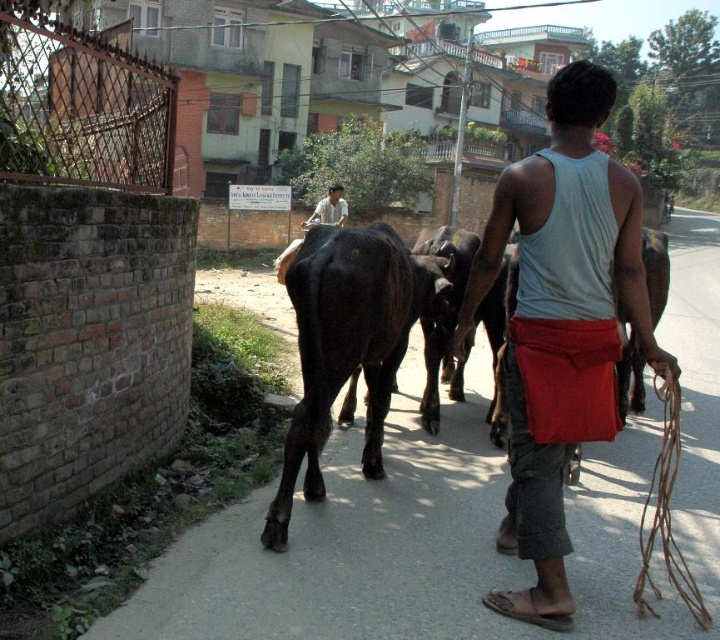
Which of these two, black glossy bull at center or light brown shirt at upper center, stands taller?

With more height is light brown shirt at upper center.

Can you confirm if black glossy bull at center is wider than light brown shirt at upper center?

No.

Who is more forward, (341,236) or (343,216)?

Positioned in front is point (341,236).

In order to click on black glossy bull at center in this screenshot , I will do `click(342, 348)`.

Which is above, gray cotton tank top at center or light brown shirt at upper center?

Positioned higher is light brown shirt at upper center.

Looking at this image, which of these two, gray cotton tank top at center or light brown shirt at upper center, stands shorter?

gray cotton tank top at center

Who is more forward, (577, 262) or (318, 214)?

Positioned in front is point (577, 262).

The width and height of the screenshot is (720, 640). In order to click on gray cotton tank top at center in this screenshot , I will do `click(559, 323)`.

Does gray cotton tank top at center have a larger size compared to black glossy bull at center?

Incorrect, gray cotton tank top at center is not larger than black glossy bull at center.

Can you confirm if gray cotton tank top at center is thinner than black glossy bull at center?

Yes, gray cotton tank top at center is thinner than black glossy bull at center.

Which is in front, point (531, 176) or point (292, 280)?

Positioned in front is point (531, 176).

The height and width of the screenshot is (640, 720). Find the location of `gray cotton tank top at center`. gray cotton tank top at center is located at coordinates (559, 323).